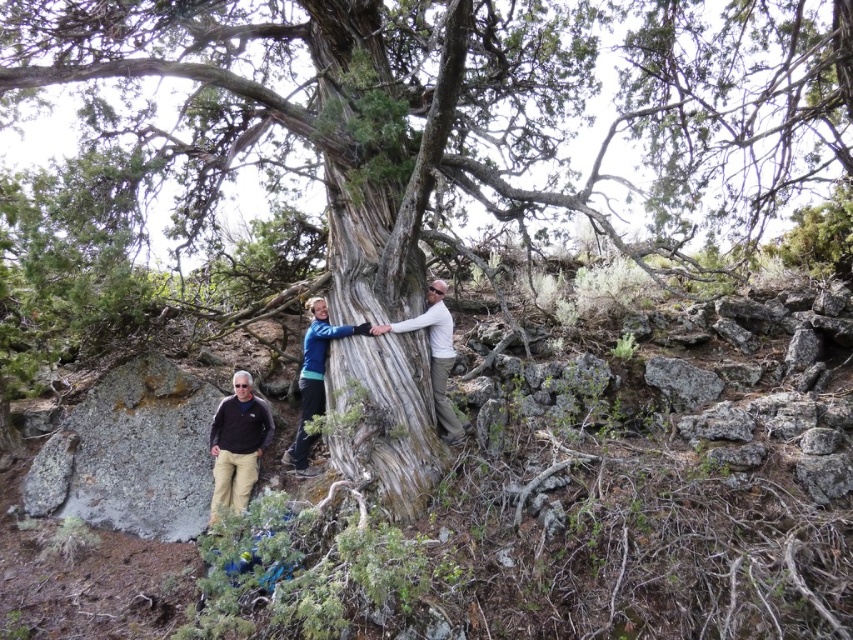
Question: Is gray textured tree trunk at center to the right of smooth gray bark at center from the viewer's perspective?

Choices:
 (A) no
 (B) yes

Answer: (A)

Question: Among these points, which one is nearest to the camera?

Choices:
 (A) [318, 385]
 (B) [384, 324]
 (C) [442, 413]
 (D) [268, 419]

Answer: (B)

Question: From the image, what is the correct spatial relationship of blue fabric jacket at center in relation to smooth gray bark at center?

Choices:
 (A) left
 (B) right

Answer: (A)

Question: Among these objects, which one is nearest to the camera?

Choices:
 (A) smooth skin hand at center
 (B) gray textured tree trunk at center

Answer: (B)

Question: Can you confirm if blue fabric jacket at center is positioned to the left of smooth skin hand at center?

Choices:
 (A) no
 (B) yes

Answer: (B)

Question: Which point appears closest to the camera in this image?

Choices:
 (A) (373, 330)
 (B) (219, 404)
 (C) (437, 320)

Answer: (A)